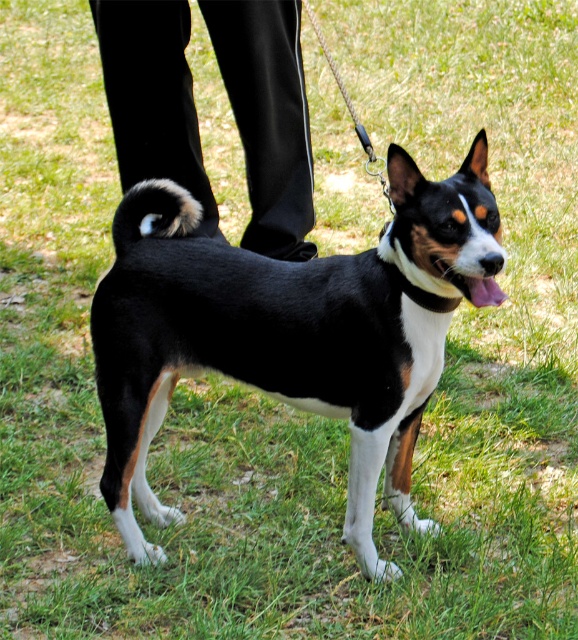
You are a photographer trying to capture a closeup of the fuzzy black tail at center. Given that your camera can focus on objects within 2 meters, will you need to move closer to the subject?

The fuzzy black tail at center is 2.48 meters away from the camera, which is beyond the 2 meter focus range. Move closer to within 2 meters to capture a clear closeup.

You are a photographer trying to capture the black and white fur dog at center and the black smooth pants at lower center in a single frame. Based on their widths, which object should you focus on to ensure both fit in the frame without cropping?

The black and white fur dog at center is wider than the black smooth pants at lower center, so you should focus on the black and white fur dog at center to ensure both fit in the frame without cropping.

You are standing in front of the dog and want to place two markers on the ground at the coordinates point (449, 266) and point (198, 216). Which marker will be closer to you?

Point (449, 266) is closer to the viewer than point (198, 216), so the marker at point (449, 266) will be closer to you.